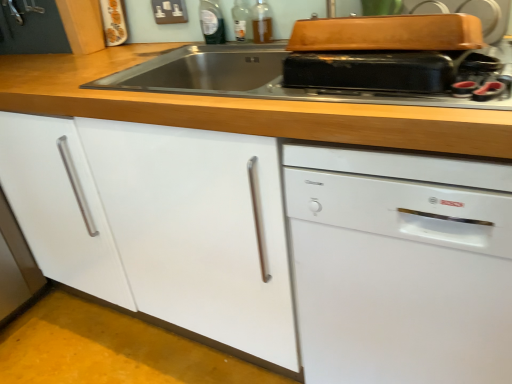
Question: Is the position of wooden at upper center less distant than that of translucent glass bottle at upper center, which is the 1th bottle in right-to-left order?

Choices:
 (A) no
 (B) yes

Answer: (B)

Question: Could you tell me if wooden at upper center is turned towards translucent glass bottle at upper center, acting as the 3th bottle starting from the left?

Choices:
 (A) no
 (B) yes

Answer: (A)

Question: Does wooden at upper center come behind translucent glass bottle at upper center, acting as the 3th bottle starting from the left?

Choices:
 (A) no
 (B) yes

Answer: (A)

Question: Does wooden at upper center have a lesser width compared to translucent glass bottle at upper center, acting as the 3th bottle starting from the left?

Choices:
 (A) yes
 (B) no

Answer: (B)

Question: Does wooden at upper center have a greater height compared to translucent glass bottle at upper center, acting as the 3th bottle starting from the left?

Choices:
 (A) no
 (B) yes

Answer: (B)

Question: In the image, is matte black toaster at upper center positioned in front of or behind white matte cabinet at center?

Choices:
 (A) front
 (B) behind

Answer: (A)

Question: From the image's perspective, is matte black toaster at upper center positioned above or below white matte cabinet at center?

Choices:
 (A) below
 (B) above

Answer: (B)

Question: Considering the positions of point tap(288, 84) and point tap(205, 246), is point tap(288, 84) closer or farther from the camera than point tap(205, 246)?

Choices:
 (A) closer
 (B) farther

Answer: (A)

Question: From a real-world perspective, is matte black toaster at upper center physically located above or below white matte cabinet at center?

Choices:
 (A) below
 (B) above

Answer: (B)

Question: Looking at their shapes, would you say white glossy dishwasher at right is wider or thinner than transparent glass bottle at upper center, the 2th bottle in the right-to-left sequence?

Choices:
 (A) thin
 (B) wide

Answer: (B)

Question: Is white glossy dishwasher at right taller or shorter than transparent glass bottle at upper center, acting as the 2th bottle starting from the left?

Choices:
 (A) tall
 (B) short

Answer: (A)

Question: Considering the relative positions of white glossy dishwasher at right and transparent glass bottle at upper center, the 2th bottle in the right-to-left sequence, in the image provided, is white glossy dishwasher at right to the left or to the right of transparent glass bottle at upper center, the 2th bottle in the right-to-left sequence,?

Choices:
 (A) right
 (B) left

Answer: (A)

Question: Is point (358, 208) positioned closer to the camera than point (247, 29)?

Choices:
 (A) closer
 (B) farther

Answer: (A)

Question: Is point (211, 39) closer or farther from the camera than point (314, 54)?

Choices:
 (A) closer
 (B) farther

Answer: (B)

Question: Which is correct: transparent plastic bottle at upper center, which is counted as the third bottle, starting from the right, is inside matte black toaster at upper center, or outside of it?

Choices:
 (A) inside
 (B) outside

Answer: (B)